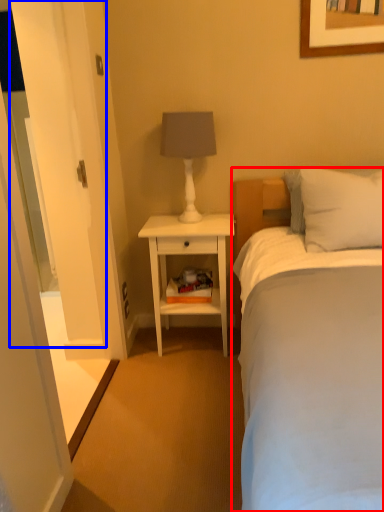
Question: Among these objects, which one is farthest to the camera, bed (highlighted by a red box) or glass door (highlighted by a blue box)?

Choices:
 (A) bed
 (B) glass door

Answer: (B)